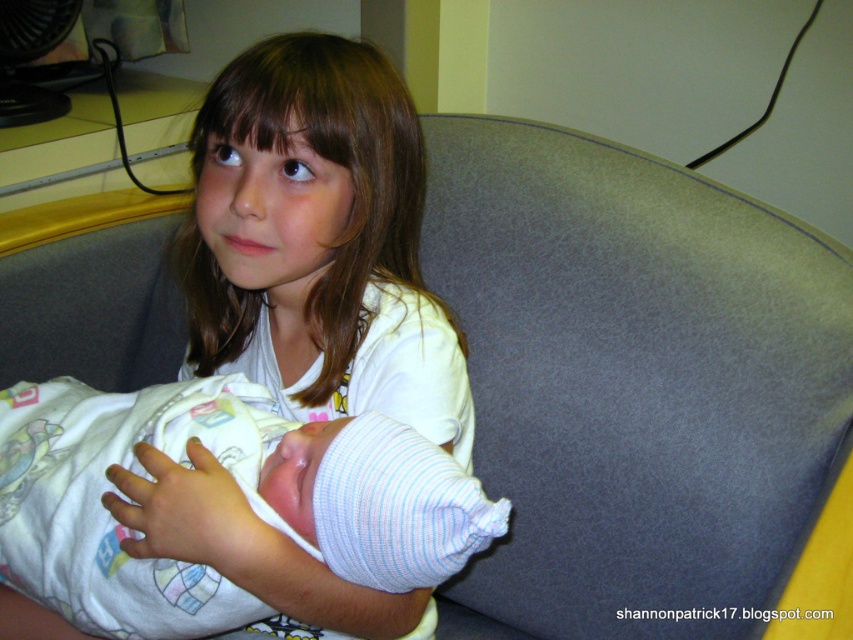
This screenshot has width=853, height=640. Describe the element at coordinates (235, 483) in the screenshot. I see `white soft fabric newborn at center` at that location.

What do you see at coordinates (235, 483) in the screenshot? This screenshot has width=853, height=640. I see `white soft fabric newborn at center` at bounding box center [235, 483].

This screenshot has height=640, width=853. Find the location of `white soft fabric newborn at center`. white soft fabric newborn at center is located at coordinates (235, 483).

Does white soft shirt at center come behind white soft fabric at center?

Yes.

Which of these two, white soft shirt at center or white soft fabric at center, stands taller?

white soft shirt at center

Identify the location of white soft shirt at center. (318, 241).

Who is shorter, white soft shirt at center or white striped fabric at center?

white striped fabric at center is shorter.

Is white soft shirt at center above white striped fabric at center?

Indeed, white soft shirt at center is positioned over white striped fabric at center.

Between point (413, 168) and point (300, 582), which one is positioned behind?

Positioned behind is point (413, 168).

Image resolution: width=853 pixels, height=640 pixels. I want to click on white soft shirt at center, so click(x=318, y=241).